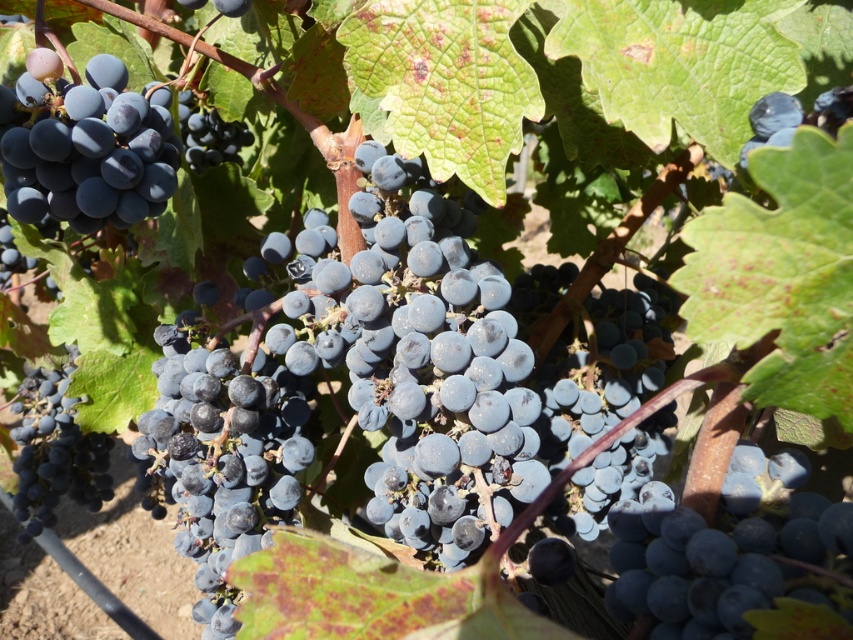
Is point (787, 524) in front of point (9, 246)?

That is True.

Between shiny dark blue grapes at center and shiny dark blue grape at upper left, which one is positioned lower?

shiny dark blue grapes at center is below.

I want to click on shiny dark blue grapes at center, so click(730, 570).

The width and height of the screenshot is (853, 640). In order to click on shiny dark blue grapes at center in this screenshot , I will do `click(730, 570)`.

Consider the image. Does shiny dark blue grapes at center have a greater width compared to shiny dark blue grape at lower left?

In fact, shiny dark blue grapes at center might be narrower than shiny dark blue grape at lower left.

Who is taller, shiny dark blue grapes at center or shiny dark blue grape at lower left?

Standing taller between the two is shiny dark blue grape at lower left.

I want to click on shiny dark blue grapes at center, so click(730, 570).

Does shiny dark blue grapes at upper left have a lesser width compared to shiny dark blue grape at lower left?

Yes, shiny dark blue grapes at upper left is thinner than shiny dark blue grape at lower left.

Can you confirm if shiny dark blue grapes at upper left is wider than shiny dark blue grape at lower left?

Incorrect, shiny dark blue grapes at upper left's width does not surpass shiny dark blue grape at lower left's.

Locate an element on the screen. shiny dark blue grapes at upper left is located at coordinates (84, 147).